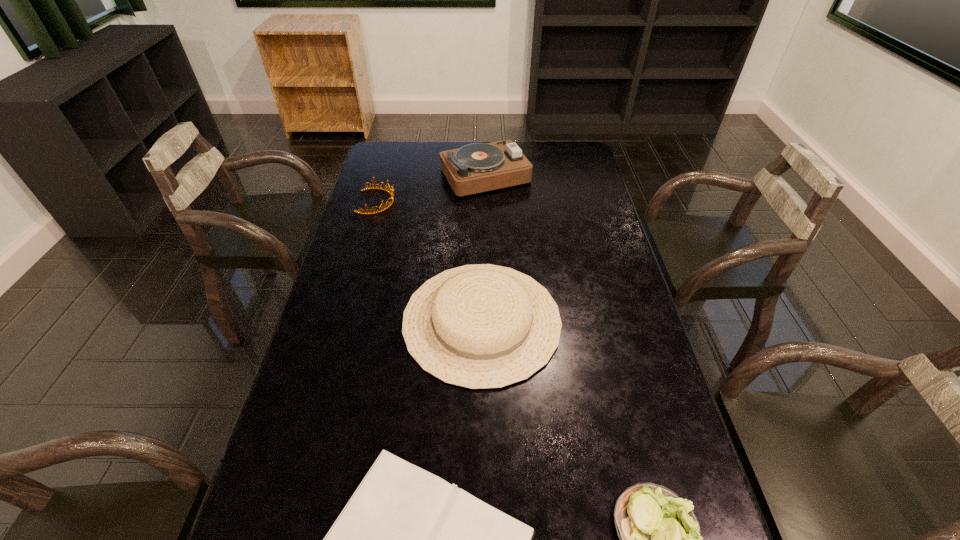
At what (x,y) coordinates should I click in order to perform the action: click on the tallest object. Please return your answer as a coordinate pair (x, y). The height and width of the screenshot is (540, 960). Looking at the image, I should click on (478, 167).

The height and width of the screenshot is (540, 960). Find the location of `sunhat`. sunhat is located at coordinates (483, 326).

You are a GUI agent. You are given a task and a screenshot of the screen. Output one action in this format:
    pyautogui.click(x=<x>, y=<y>)
    Task: Click on the tiara
    
    Given the screenshot: What is the action you would take?
    pyautogui.click(x=391, y=191)

Locate an element on the screen. free spot located on the left of the tallest object is located at coordinates (370, 176).

Identify the location of free point located on the right of the sunhat. (592, 321).

This screenshot has height=540, width=960. Identify the location of vacant space situated 0.060m on the front-facing side of the leftmost object. point(413,201).

Locate an element on the screen. The image size is (960, 540). object that is at the far edge is located at coordinates (478, 167).

The height and width of the screenshot is (540, 960). Identify the location of object at the left edge. (391, 191).

At what (x,y) coordinates should I click in order to perform the action: click on vacant point at the far edge. Please return your answer as a coordinate pair (x, y). The height and width of the screenshot is (540, 960). Looking at the image, I should click on (523, 148).

Identify the location of free region at the left edge of the desktop. (330, 523).